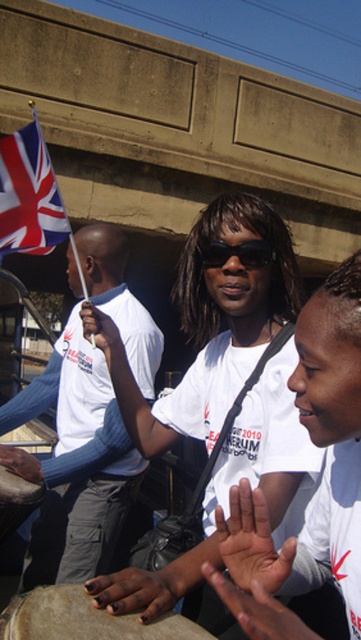
Is smooth skin hand at center shorter than black matte sunglasses at center?

In fact, smooth skin hand at center may be taller than black matte sunglasses at center.

Measure the distance from smooth skin hand at center to black matte sunglasses at center.

smooth skin hand at center and black matte sunglasses at center are 36.94 inches apart from each other.

Describe the element at coordinates (255, 532) in the screenshot. I see `smooth skin hand at center` at that location.

Identify the location of smooth skin hand at center. This screenshot has width=361, height=640. (255, 532).

Does white cotton t-shirt at center have a greater height compared to brushed metal drum at lower left?

Yes.

From the picture: Is white cotton t-shirt at center to the right of brushed metal drum at lower left from the viewer's perspective?

Indeed, white cotton t-shirt at center is positioned on the right side of brushed metal drum at lower left.

At what (x,y) coordinates should I click in order to perform the action: click on white cotton t-shirt at center. Please return your answer as a coordinate pair (x, y). Looking at the image, I should click on click(x=76, y=461).

Find the location of a particular element. This screenshot has width=361, height=640. white cotton t-shirt at center is located at coordinates (76, 461).

Does white matte t-shirt at center have a greater height compared to white cotton t-shirt at center?

In fact, white matte t-shirt at center may be shorter than white cotton t-shirt at center.

At what (x,y) coordinates should I click in order to perform the action: click on white matte t-shirt at center. Please return your answer as a coordinate pair (x, y). Looking at the image, I should click on (210, 324).

Where is `white matte t-shirt at center`? This screenshot has width=361, height=640. white matte t-shirt at center is located at coordinates (210, 324).